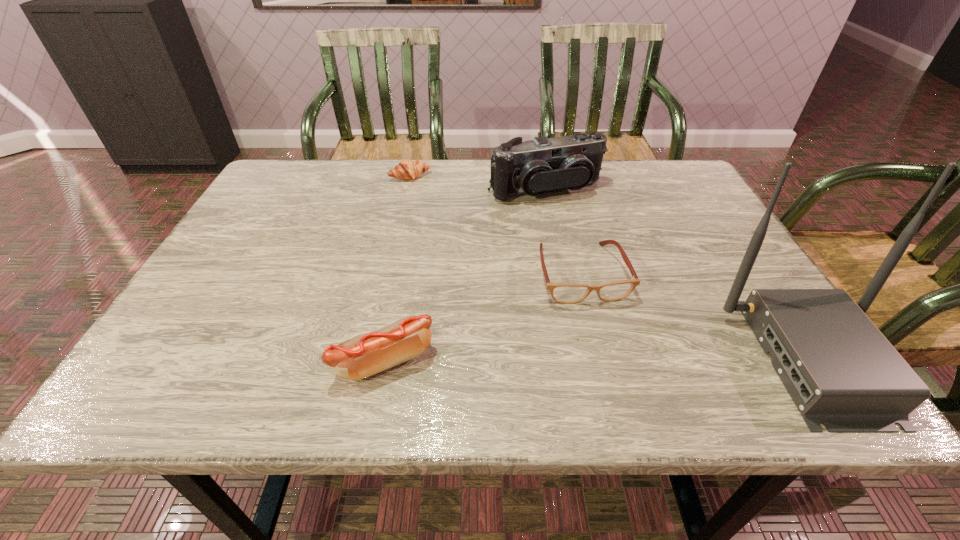
The width and height of the screenshot is (960, 540). I want to click on object at the near right corner, so click(x=840, y=370).

Where is `blank space at the far edge`? This screenshot has width=960, height=540. blank space at the far edge is located at coordinates (596, 202).

In the image, there is a desktop. At what (x,y) coordinates should I click in order to perform the action: click on vacant space at the near edge. Please return your answer as a coordinate pair (x, y). The width and height of the screenshot is (960, 540). Looking at the image, I should click on (568, 336).

The height and width of the screenshot is (540, 960). In the image, there is a desktop. What are the coordinates of `vacant area at the left edge` in the screenshot? It's located at (221, 320).

The height and width of the screenshot is (540, 960). What are the coordinates of `vacant region at the right edge` in the screenshot? It's located at (709, 227).

Identify the location of vacant region at the far left corner of the desktop. (276, 170).

Locate an element on the screen. The height and width of the screenshot is (540, 960). free point between the camcorder and the spectacles is located at coordinates (564, 232).

At what (x,y) coordinates should I click in order to perform the action: click on unoccupied position between the spectacles and the third shortest object. Please return your answer as a coordinate pair (x, y). Looking at the image, I should click on tap(483, 317).

This screenshot has width=960, height=540. What are the coordinates of `free space between the pastry and the second tallest object` in the screenshot? It's located at (478, 183).

You are a GUI agent. You are given a task and a screenshot of the screen. Output one action in this format:
    pyautogui.click(x=<x>, y=<y>)
    Task: Click on the free space between the second tallest object and the tallest object
    The image size is (960, 540).
    Given the screenshot: What is the action you would take?
    pyautogui.click(x=680, y=274)